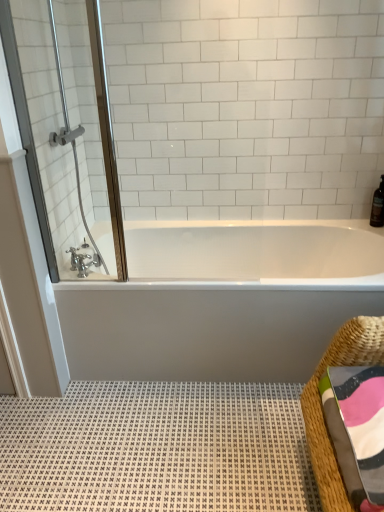
I want to click on free point above white textured bath mat at lower center (from a real-world perspective), so click(144, 434).